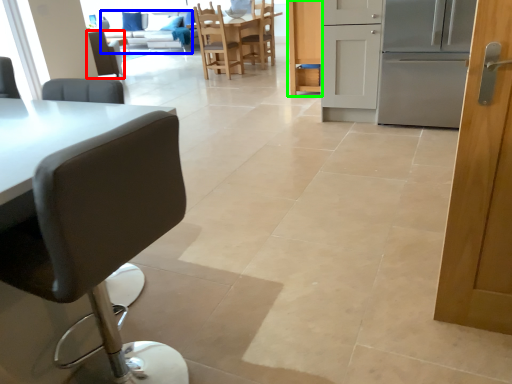
Question: Which object is the closest to the chair (highlighted by a red box)? Choose among these: couch (highlighted by a blue box) or cabinetry (highlighted by a green box).

Choices:
 (A) couch
 (B) cabinetry

Answer: (A)